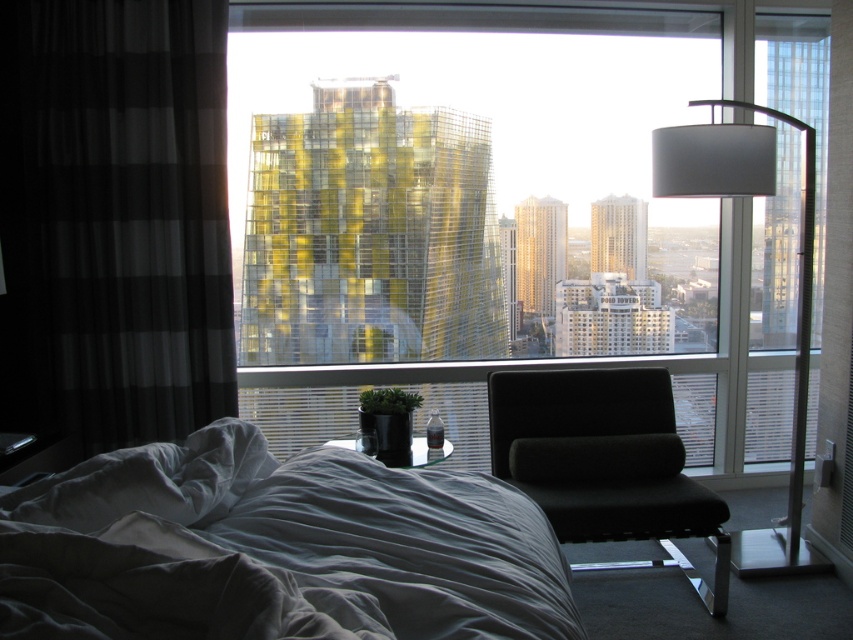
You are a guest in the hotel room and want to sit on the largest piece of furniture. Which one should you choose between the gray cotton bed at lower left and the black fabric swivel chair at center?

The gray cotton bed at lower left is bigger than the black fabric swivel chair at center, so you should choose the gray cotton bed at lower left.

You are standing in the hotel room and want to take a photo of the city view through the window. You need to position yourself at a point that is exactly 4 meters away from the camera. Is the point at coordinates point (x=486, y=22) suitable for this purpose?

The distance of point (x=486, y=22) from camera is 4.04 meters, which is very close to 4 meters. Therefore, the point at coordinates point (x=486, y=22) is suitable for positioning yourself 4 meters away from the camera.